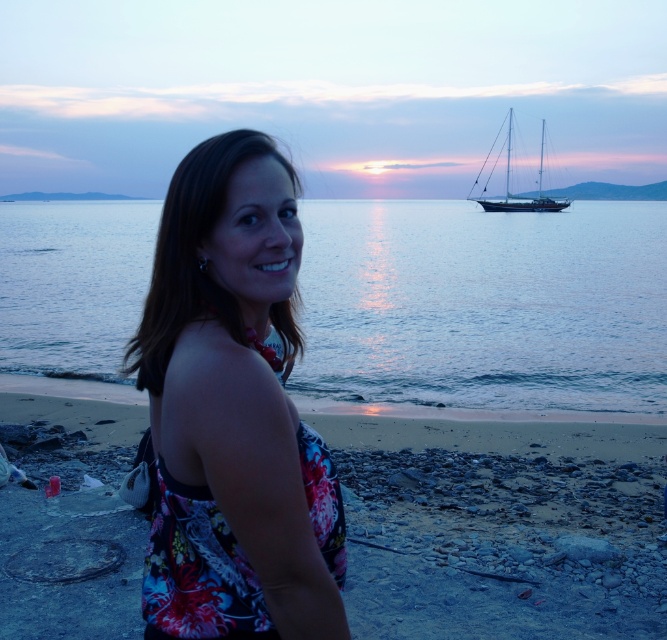
Does floral fabric dress at center appear under dark blue polished wood sailboat at upper right?

Correct, floral fabric dress at center is located below dark blue polished wood sailboat at upper right.

Find the location of a particular element. Image resolution: width=667 pixels, height=640 pixels. floral fabric dress at center is located at coordinates (233, 410).

Where is `floral fabric dress at center`? floral fabric dress at center is located at coordinates (233, 410).

Does point (27, 282) lie behind point (622, 529)?

That is True.

Is blue water at center to the right of smooth sand at lower center from the viewer's perspective?

Indeed, blue water at center is positioned on the right side of smooth sand at lower center.

Between point (640, 289) and point (41, 410), which one is positioned behind?

The point (640, 289) is behind.

I want to click on blue water at center, so click(x=484, y=305).

Does smooth sand at lower center appear under floral fabric dress at center?

Indeed, smooth sand at lower center is positioned under floral fabric dress at center.

Who is lower down, smooth sand at lower center or floral fabric dress at center?

smooth sand at lower center

The width and height of the screenshot is (667, 640). I want to click on smooth sand at lower center, so click(498, 525).